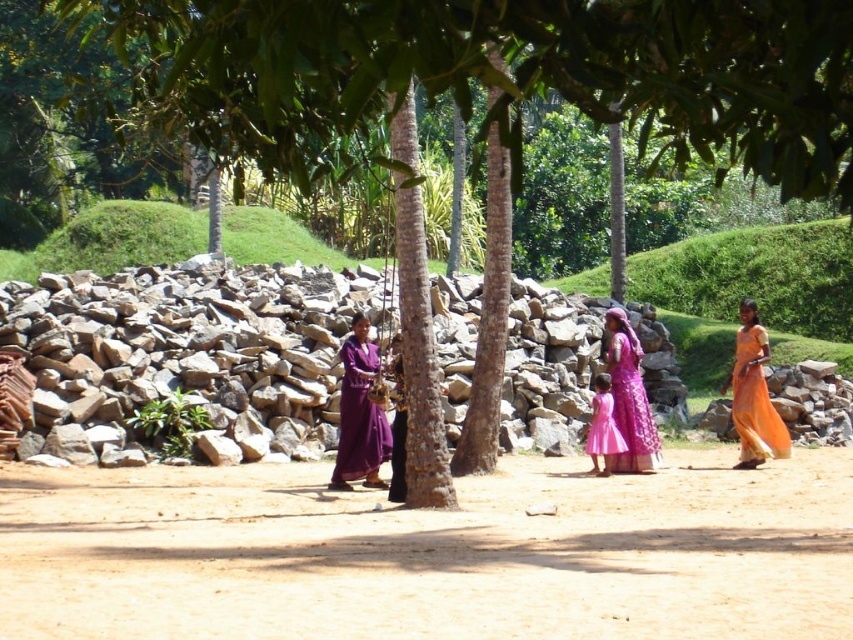
Question: Is purple silk robe at center below purple satin dress at center?

Choices:
 (A) no
 (B) yes

Answer: (B)

Question: Which of the following is the farthest from the observer?

Choices:
 (A) brown sandy soil at center
 (B) gray rough rocks at center

Answer: (B)

Question: Does purple satin dress at center appear over pink satin dress at center?

Choices:
 (A) yes
 (B) no

Answer: (A)

Question: Which object is the farthest from the brown sandy soil at center?

Choices:
 (A) orange satin dress at right
 (B) gray rough rocks at center

Answer: (A)

Question: Which object appears closest to the camera in this image?

Choices:
 (A) purple silk robe at center
 (B) purple satin dress at center
 (C) gray rough rocks at center

Answer: (C)

Question: Does orange satin dress at right appear over purple satin dress at center?

Choices:
 (A) yes
 (B) no

Answer: (B)